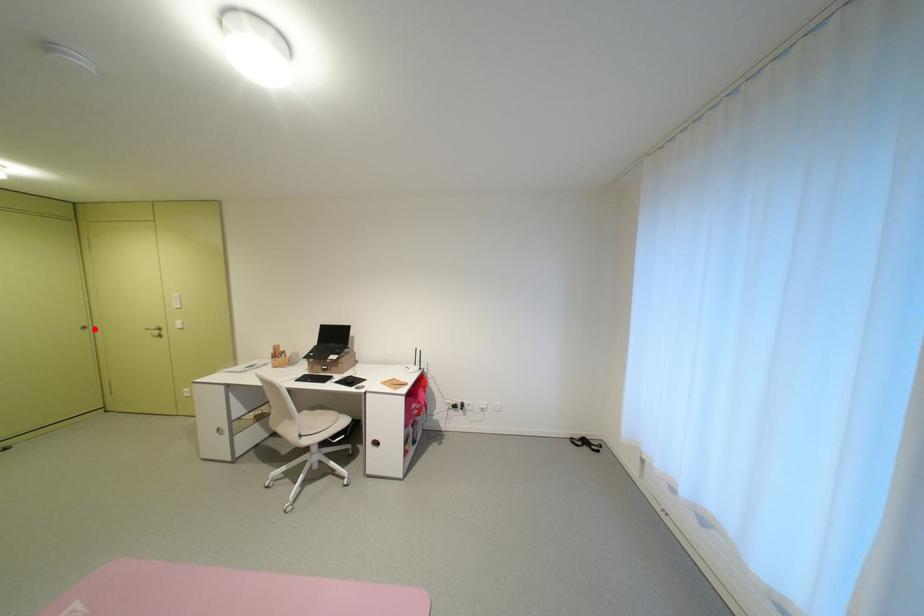
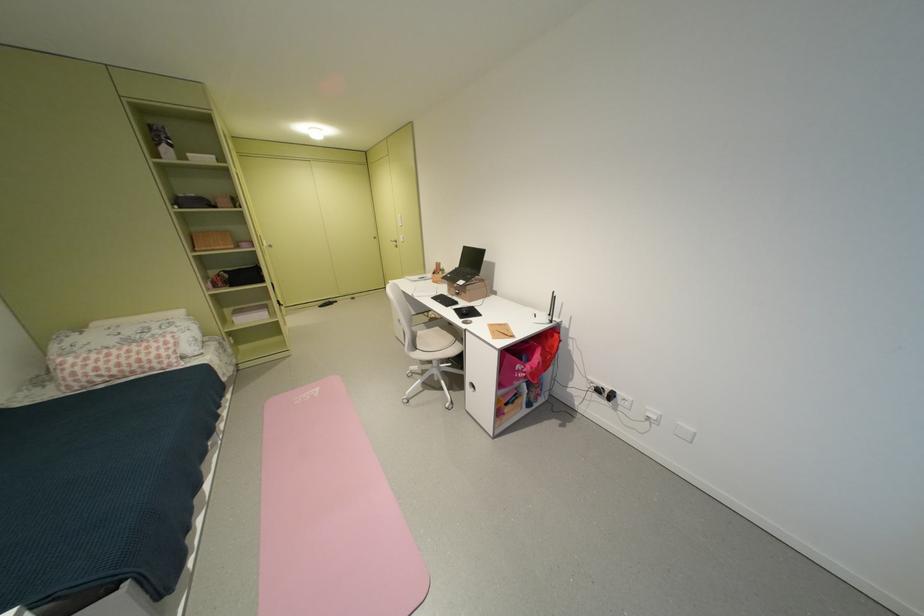
In the second image, find the point that corresponds to the highlighted location in the first image.

(383, 238)